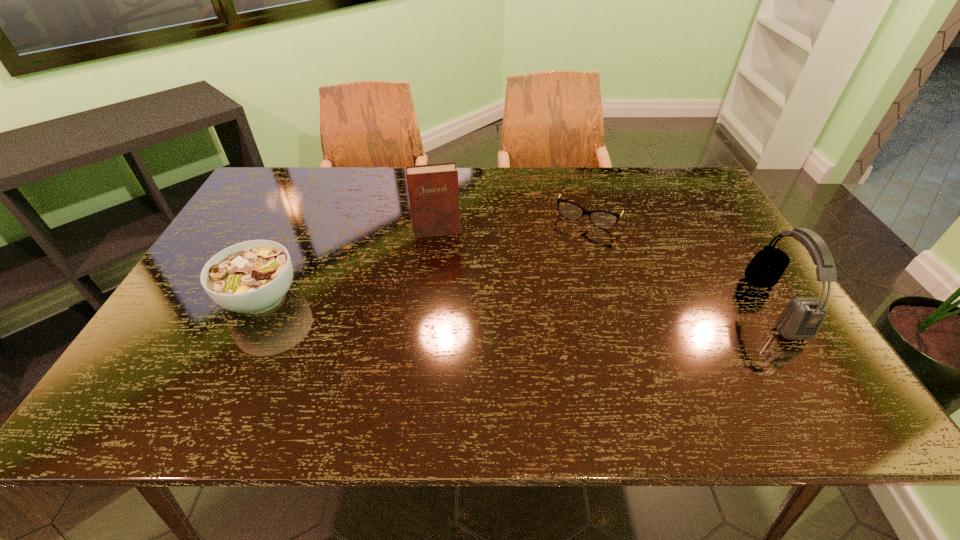
The height and width of the screenshot is (540, 960). Find the location of `free spot that satisfies the following two spatial constraints: 1. on the front side of the rightmost object; 2. on the headband of the third object from left to right`. free spot that satisfies the following two spatial constraints: 1. on the front side of the rightmost object; 2. on the headband of the third object from left to right is located at coordinates (623, 306).

What are the coordinates of `vacant space that satisfies the following two spatial constraints: 1. on the back side of the second object from left to right; 2. on the right side of the third tallest object` in the screenshot? It's located at (294, 231).